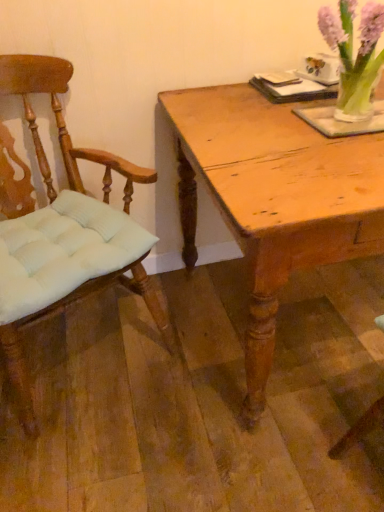
What do you see at coordinates (352, 55) in the screenshot? I see `translucent glass vase at upper right` at bounding box center [352, 55].

Describe the element at coordinates (273, 199) in the screenshot. The image size is (384, 512). I see `light brown wooden table at center` at that location.

Where is `light brown wood chair at left`? The image size is (384, 512). light brown wood chair at left is located at coordinates (65, 232).

At what (x,y) coordinates should I click in order to perform the action: click on floral arrangement above the light brown wood chair at left (from a real-world perspective). Please return your answer as a coordinate pair (x, y). Looking at the image, I should click on (352, 55).

Is translucent glass vase at upper right placed right next to light brown wood chair at left?

No, translucent glass vase at upper right is not beside light brown wood chair at left.

From a real-world perspective, which object stands above the other?

translucent glass vase at upper right.

From the image's perspective, between light brown wooden table at center and light brown wood chair at left, who is located below?

light brown wood chair at left is shown below in the image.

Is light brown wooden table at center positioned with its back to light brown wood chair at left?

No, light brown wood chair at left is not at the back of light brown wooden table at center.

Is the surface of light brown wooden table at center in direct contact with light brown wood chair at left?

No, light brown wooden table at center is not in contact with light brown wood chair at left.

Consider the image. Can you tell me how much light brown wooden table at center and light brown wood chair at left differ in facing direction?

The facing directions of light brown wooden table at center and light brown wood chair at left are 24.7 degrees apart.

Who is taller, light brown wood chair at left or light brown wooden table at center?

With more height is light brown wood chair at left.

Can you confirm if light brown wood chair at left is thinner than light brown wooden table at center?

Correct, the width of light brown wood chair at left is less than that of light brown wooden table at center.

From the picture: Considering the positions of objects light brown wood chair at left and light brown wooden table at center in the image provided, who is in front, light brown wood chair at left or light brown wooden table at center?

light brown wood chair at left.

Is light brown wood chair at left oriented away from light brown wooden table at center?

light brown wood chair at left does not have its back to light brown wooden table at center.

From the image's perspective, does light brown wooden table at center appear lower than translucent glass vase at upper right?

Indeed, from the image's perspective, light brown wooden table at center is shown beneath translucent glass vase at upper right.

Is translucent glass vase at upper right surrounded by light brown wooden table at center?

No.

Does light brown wooden table at center turn towards translucent glass vase at upper right?

No, light brown wooden table at center does not turn towards translucent glass vase at upper right.

Are light brown wooden table at center and translucent glass vase at upper right beside each other?

No, light brown wooden table at center is not beside translucent glass vase at upper right.

Is point (367, 90) closer or farther from the camera than point (248, 109)?

Point (367, 90).

From the image's perspective, which is above, translucent glass vase at upper right or light brown wooden table at center?

translucent glass vase at upper right is shown above in the image.

Looking at this image, can you confirm if translucent glass vase at upper right is smaller than light brown wooden table at center?

Correct, translucent glass vase at upper right occupies less space than light brown wooden table at center.

From their relative heights in the image, would you say translucent glass vase at upper right is taller or shorter than light brown wooden table at center?

Clearly, translucent glass vase at upper right is shorter compared to light brown wooden table at center.

Is light brown wood chair at left far away from translucent glass vase at upper right?

No.

Between point (84, 223) and point (328, 11), which one is positioned in front?

The point (328, 11) is more forward.

Which is behind, light brown wood chair at left or translucent glass vase at upper right?

translucent glass vase at upper right is more distant.

Considering the positions of objects light brown wood chair at left and translucent glass vase at upper right in the image provided, who is more to the right, light brown wood chair at left or translucent glass vase at upper right?

translucent glass vase at upper right.

At what (x,y) coordinates should I click in order to perform the action: click on chair on the left of the translucent glass vase at upper right. Please return your answer as a coordinate pair (x, y). Looking at the image, I should click on point(65,232).

Locate an element on the screen. This screenshot has height=512, width=384. chair positioned vertically above the light brown wooden table at center (from a real-world perspective) is located at coordinates (65, 232).

Considering their positions, is light brown wood chair at left positioned closer to light brown wooden table at center than translucent glass vase at upper right?

translucent glass vase at upper right is closer to light brown wooden table at center.

Based on their spatial positions, is translucent glass vase at upper right or light brown wood chair at left closer to light brown wooden table at center?

Among the two, translucent glass vase at upper right is located nearer to light brown wooden table at center.

Estimate the real-world distances between objects in this image. Which object is further from translucent glass vase at upper right, light brown wood chair at left or light brown wooden table at center?

light brown wood chair at left lies further to translucent glass vase at upper right than the other object.

From the image, which object appears to be farther from translucent glass vase at upper right, light brown wooden table at center or light brown wood chair at left?

light brown wood chair at left is further to translucent glass vase at upper right.

Estimate the real-world distances between objects in this image. Which object is further from light brown wood chair at left, translucent glass vase at upper right or light brown wooden table at center?

translucent glass vase at upper right.

Estimate the real-world distances between objects in this image. Which object is further from light brown wood chair at left, light brown wooden table at center or translucent glass vase at upper right?

translucent glass vase at upper right.

In order to click on floral arrangement situated between light brown wood chair at left and light brown wooden table at center from left to right in this screenshot , I will do `click(352, 55)`.